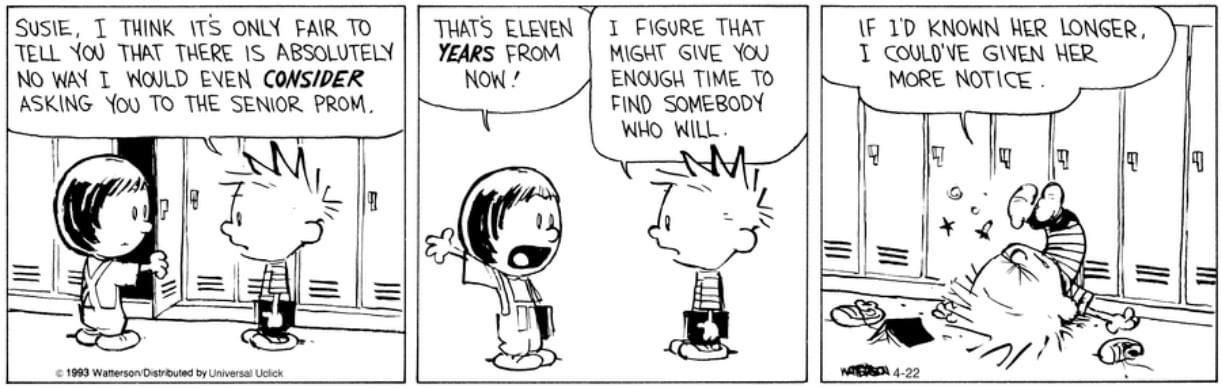
Locate an element on the screen. locker handles is located at coordinates (869, 156), (934, 156), (1005, 158), (1059, 157), (1137, 162), (1199, 160).